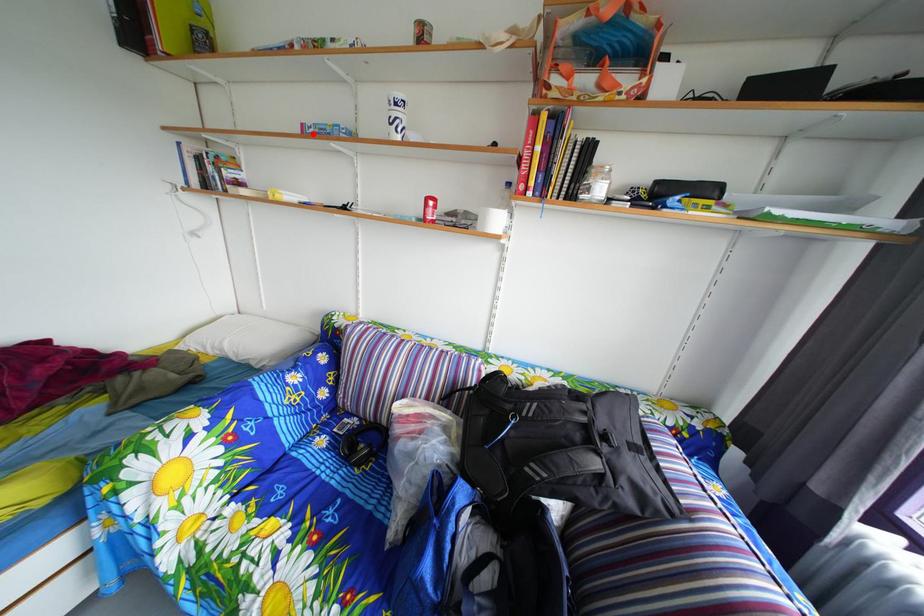
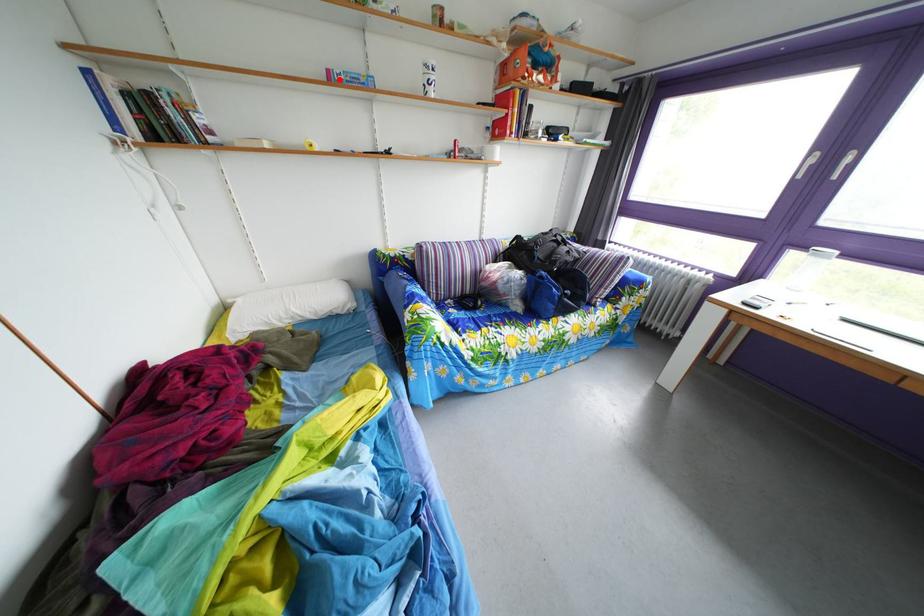
In the scene shown: I am providing you with two images of the same scene from different viewpoints. A red point is marked on the first image and another point is marked on the second image. Is the red point in image1 aligned with the point shown in image2?

Yes